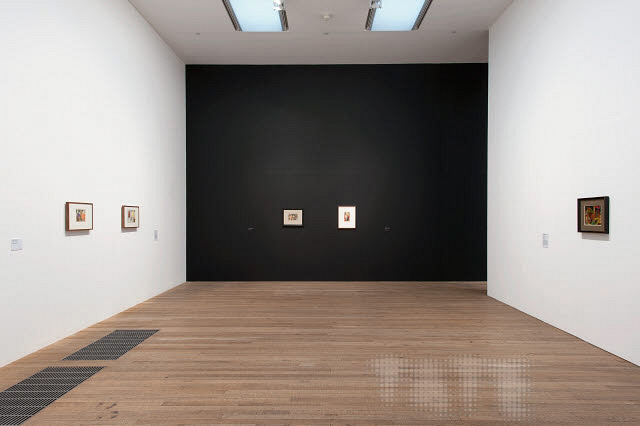
Locate an element on the screen. The width and height of the screenshot is (640, 426). 1 picture on the white wall on the right is located at coordinates (598, 215).